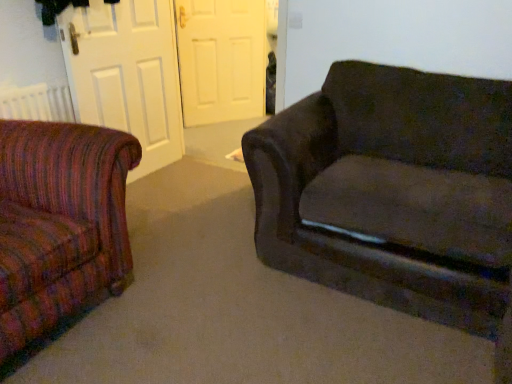
Question: Is point (246, 109) closer or farther from the camera than point (334, 67)?

Choices:
 (A) farther
 (B) closer

Answer: (A)

Question: From the image's perspective, is white matte door at center, which appears as the second screen door when viewed from the front, located above or below dark fabric couch at right?

Choices:
 (A) above
 (B) below

Answer: (A)

Question: Estimate the real-world distances between objects in this image. Which object is farther from the dark fabric couch at right?

Choices:
 (A) white matte door at center, which appears as the second screen door when viewed from the front
 (B) matte white door at left, which ranks as the 1th screen door in front-to-back order

Answer: (A)

Question: Which object is positioned closest to the matte white door at left, which is the second screen door from back to front?

Choices:
 (A) white matte door at center, placed as the 1th screen door when sorted from back to front
 (B) dark fabric couch at right

Answer: (A)